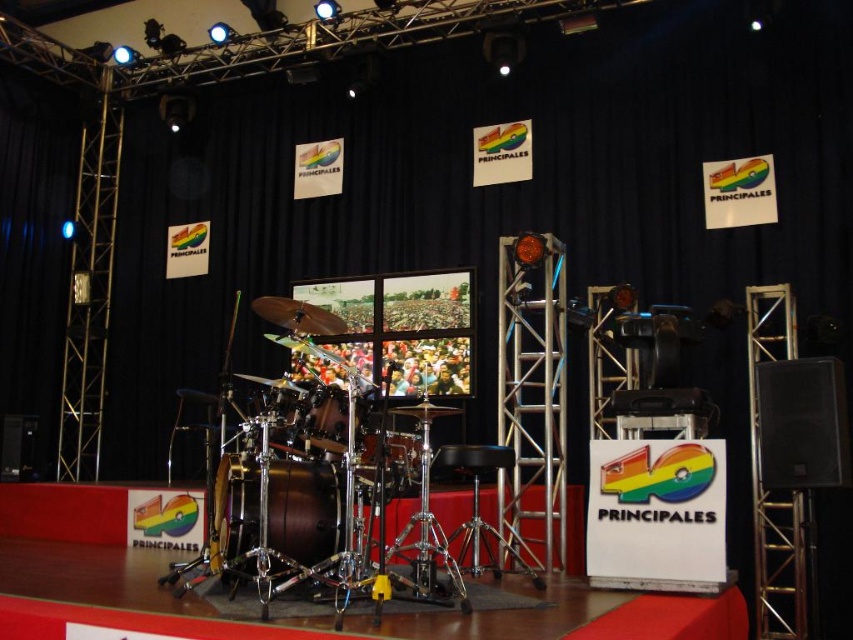
You are a stagehand preparing to move the shiny gold drum at center and the shiny brown drum at center. The storage space available has a maximum width of 20 cm. Which drum can fit through the space based on their thickness?

The shiny gold drum at center is thinner than the shiny brown drum at center, so the shiny gold drum at center can fit through the 20 cm wide storage space if its thickness is within the limit.

You are standing on the stage and looking at the two points marked on the carpet. Which point is closer to you, point [410,448] or point [343,424]?

Point [343,424] is closer to you because it is less further to the viewer than point [410,448].